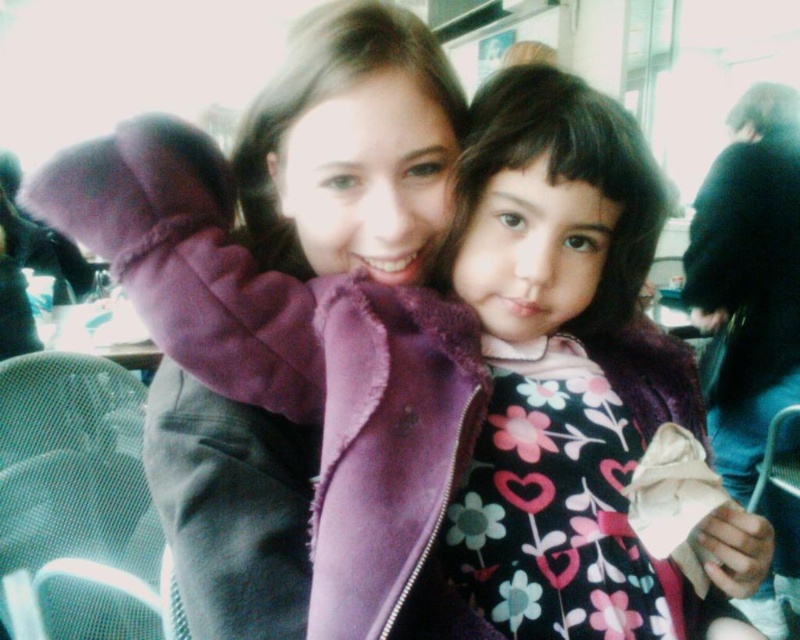
Is point (488, 545) less distant than point (366, 305)?

That is False.

Who is positioned more to the left, floral dress at center or purple fleece jacket at upper center?

purple fleece jacket at upper center is more to the left.

Find the location of a particular element. The width and height of the screenshot is (800, 640). floral dress at center is located at coordinates (572, 376).

You are a GUI agent. You are given a task and a screenshot of the screen. Output one action in this format:
    pyautogui.click(x=<x>, y=<y>)
    Task: Click on the floral dress at center
    
    Given the screenshot: What is the action you would take?
    pyautogui.click(x=572, y=376)